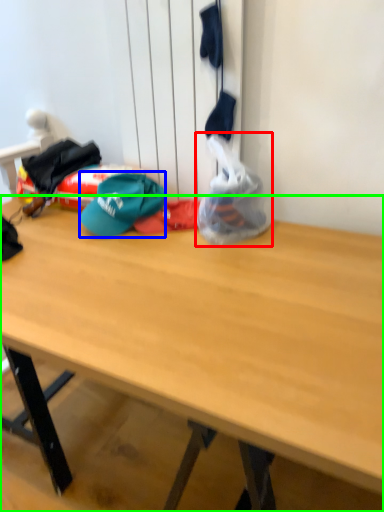
Question: Which object is the farthest from plastic bag (highlighted by a red box)? Choose among these: hat (highlighted by a blue box) or desk (highlighted by a green box).

Choices:
 (A) hat
 (B) desk

Answer: (B)